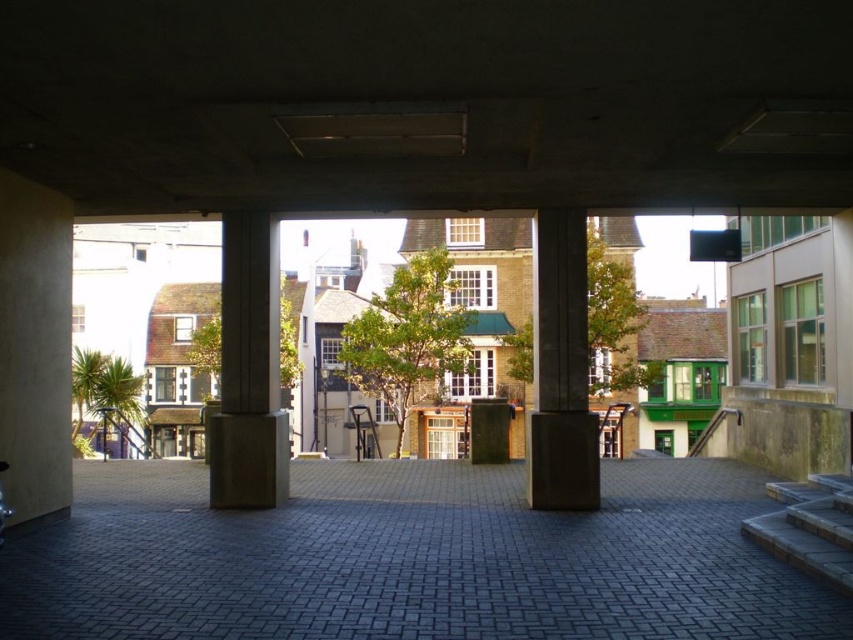
You are standing at the origin point of the coordinate system in this image. You want to walk towards the gray concrete alley at center. In which direction should you move?

The gray concrete alley at center is located at coordinate point 0.873 on the x axis and 0.483 on the y axis. Since you are at the origin point, you should move in the positive x and positive y direction to reach it.

You are a delivery robot with a 10 feet wide package. You need to navigate through the space between the concrete at center and the concrete column at center. Can your package fit through that space?

The space between the concrete at center and the concrete column at center is 11.08 feet, which is wider than the 10 feet width of the package. Therefore, the package can fit through the space between the concrete at center and the concrete column at center.